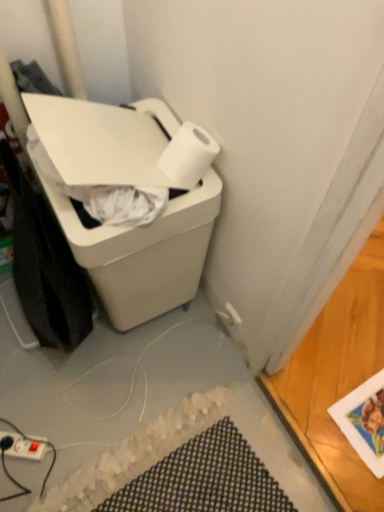
You are a GUI agent. You are given a task and a screenshot of the screen. Output one action in this format:
    pyautogui.click(x=<x>, y=<y>)
    Task: Click on the free point above black textured bath mat at lower center (from a real-world perspective)
    The height and width of the screenshot is (512, 384).
    Given the screenshot: What is the action you would take?
    [x=179, y=466]